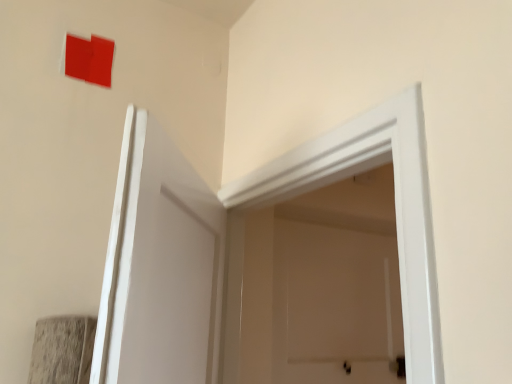
Question: Can you confirm if matte red square at upper left is taller than white smooth door at center?

Choices:
 (A) no
 (B) yes

Answer: (A)

Question: Is white smooth door at center completely or partially inside matte red square at upper left?

Choices:
 (A) yes
 (B) no

Answer: (B)

Question: Considering the relative sizes of matte red square at upper left and white smooth door at center in the image provided, is matte red square at upper left shorter than white smooth door at center?

Choices:
 (A) yes
 (B) no

Answer: (A)

Question: Is matte red square at upper left behind white smooth door at center?

Choices:
 (A) no
 (B) yes

Answer: (B)

Question: From the image's perspective, is matte red square at upper left on white smooth door at center?

Choices:
 (A) yes
 (B) no

Answer: (A)

Question: Considering the relative sizes of matte red square at upper left and white smooth door at center in the image provided, is matte red square at upper left wider than white smooth door at center?

Choices:
 (A) yes
 (B) no

Answer: (B)

Question: From a real-world perspective, is white smooth door at center beneath matte red square at upper left?

Choices:
 (A) yes
 (B) no

Answer: (A)

Question: Is white smooth door at center taller than matte red square at upper left?

Choices:
 (A) no
 (B) yes

Answer: (B)

Question: Considering the relative positions of white smooth door at center and matte red square at upper left in the image provided, is white smooth door at center behind matte red square at upper left?

Choices:
 (A) yes
 (B) no

Answer: (B)

Question: From a real-world perspective, is white smooth door at center located higher than matte red square at upper left?

Choices:
 (A) yes
 (B) no

Answer: (B)

Question: Is white smooth door at center oriented towards matte red square at upper left?

Choices:
 (A) no
 (B) yes

Answer: (A)

Question: Can you confirm if white smooth door at center is shorter than matte red square at upper left?

Choices:
 (A) no
 (B) yes

Answer: (A)

Question: Is white smooth door at center to the left or to the right of matte red square at upper left in the image?

Choices:
 (A) right
 (B) left

Answer: (A)